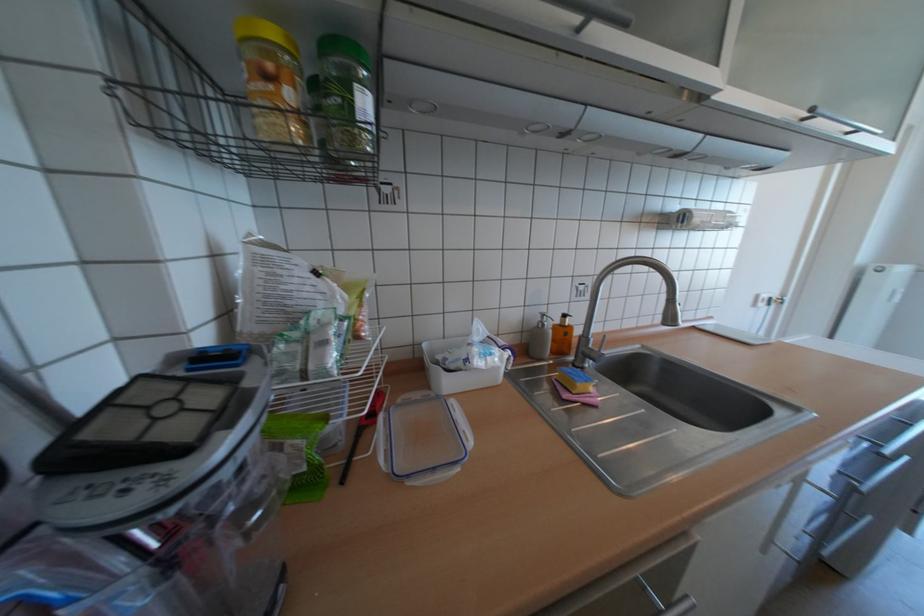
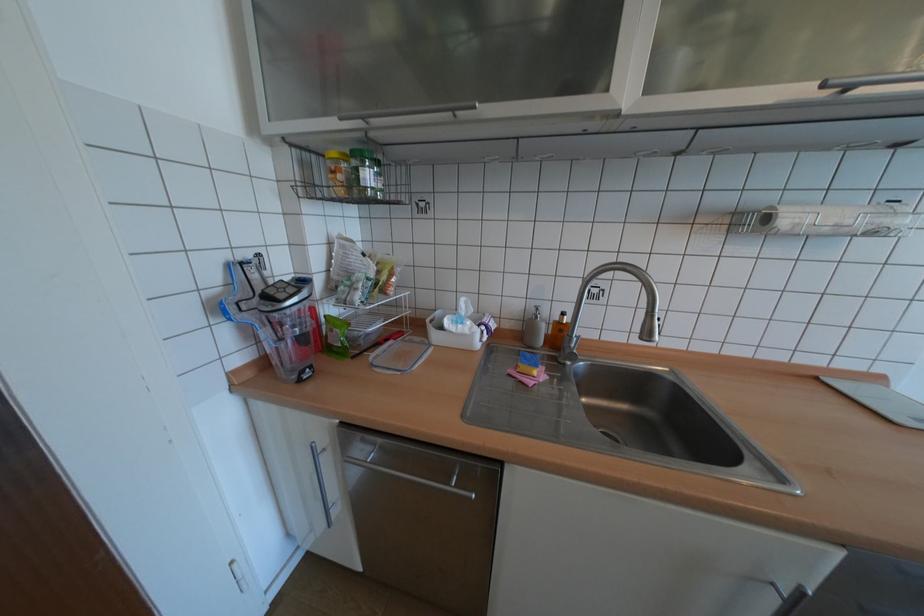
Find the pixel in the second image that matches point 298,94 in the first image.

(348, 177)